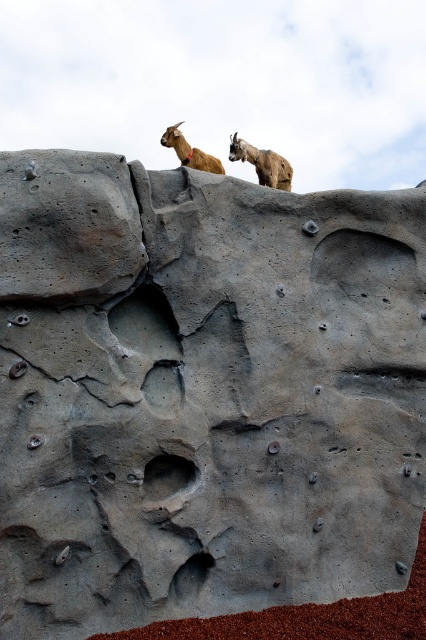
Question: Can you confirm if brown woolen goat at upper center is positioned above golden fur goat at upper center?

Choices:
 (A) yes
 (B) no

Answer: (A)

Question: Can you confirm if brown woolen goat at upper center is wider than golden fur goat at upper center?

Choices:
 (A) no
 (B) yes

Answer: (B)

Question: Which object appears farthest from the camera in this image?

Choices:
 (A) brown woolen goat at upper center
 (B) golden fur goat at upper center

Answer: (A)

Question: Is brown woolen goat at upper center above golden fur goat at upper center?

Choices:
 (A) yes
 (B) no

Answer: (A)